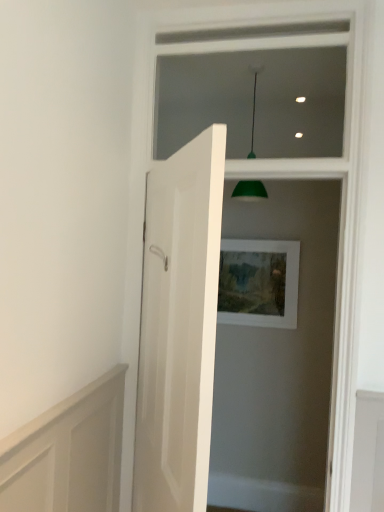
Locate an element on the screen. white wood frame at upper center is located at coordinates (252, 88).

This screenshot has height=512, width=384. Find the location of `white glossy door at center`. white glossy door at center is located at coordinates (179, 326).

What do you see at coordinates (179, 326) in the screenshot? This screenshot has width=384, height=512. I see `white glossy door at center` at bounding box center [179, 326].

At what (x,y) coordinates should I click in order to perform the action: click on green matte lampshade at upper center. Please return your answer as a coordinate pair (x, y). The height and width of the screenshot is (512, 384). Looking at the image, I should click on (250, 190).

Locate an element on the screen. The image size is (384, 512). white wood frame at upper center is located at coordinates (252, 88).

Find the location of `light fixture lying behind the white wood frame at upper center`. light fixture lying behind the white wood frame at upper center is located at coordinates (250, 190).

Looking at this image, is white wood frame at upper center not close to green matte lampshade at upper center?

No, white wood frame at upper center is not far from green matte lampshade at upper center.

Is white wood frame at upper center not within green matte lampshade at upper center?

Yes.

From the image's perspective, is white wood frame at upper center over green matte lampshade at upper center?

Yes, from the image's perspective, white wood frame at upper center is over green matte lampshade at upper center.

Considering the relative positions of white glossy door at center and white wood frame at upper center in the image provided, is white glossy door at center in front of white wood frame at upper center?

That is True.

Is white glossy door at center wider than white wood frame at upper center?

Indeed, white glossy door at center has a greater width compared to white wood frame at upper center.

Which is closer to the camera, (208, 170) or (325, 34)?

Point (208, 170) is positioned closer to the camera compared to point (325, 34).

Is white glossy door at center aimed at white wood frame at upper center?

No, white glossy door at center is not aimed at white wood frame at upper center.

Which point is more distant from viewer, (252, 117) or (258, 117)?

The point (252, 117) is farther.

How much distance is there between green matte lampshade at upper center and white wood frame at upper center?

The distance of green matte lampshade at upper center from white wood frame at upper center is 24.25 inches.

From a real-world perspective, is green matte lampshade at upper center located higher than white wood frame at upper center?

No, from a real-world perspective, green matte lampshade at upper center is not above white wood frame at upper center.

Looking at their sizes, would you say green matte lampshade at upper center is wider or thinner than white wood frame at upper center?

Considering their sizes, green matte lampshade at upper center looks broader than white wood frame at upper center.

From their relative heights in the image, would you say green matte lampshade at upper center is taller or shorter than white glossy door at center?

Clearly, green matte lampshade at upper center is shorter compared to white glossy door at center.

Is point (234, 195) farther from camera compared to point (188, 429)?

Yes, it is behind point (188, 429).

From the image's perspective, is green matte lampshade at upper center located above or below white glossy door at center?

green matte lampshade at upper center is above white glossy door at center.

Which is more to the left, green matte lampshade at upper center or white glossy door at center?

Positioned to the left is white glossy door at center.

From the image's perspective, is white wood frame at upper center above white matte picture frame at center?

Yes, from the image's perspective, white wood frame at upper center is over white matte picture frame at center.

From a real-world perspective, who is located lower, white wood frame at upper center or white matte picture frame at center?

white matte picture frame at center, from a real-world perspective.

Considering their positions, is white wood frame at upper center located in front of or behind white matte picture frame at center?

white wood frame at upper center is in front of white matte picture frame at center.

Who is taller, white wood frame at upper center or white matte picture frame at center?

white wood frame at upper center is taller.

Considering the sizes of objects white matte picture frame at center and white glossy door at center in the image provided, who is wider, white matte picture frame at center or white glossy door at center?

white glossy door at center is wider.

From the picture: From the image's perspective, does white matte picture frame at center appear higher than white glossy door at center?

Yes, from the image's perspective, white matte picture frame at center is above white glossy door at center.

Is white matte picture frame at center at the right side of white glossy door at center?

Yes, white matte picture frame at center is to the right of white glossy door at center.

Is white matte picture frame at center not close to white glossy door at center?

Yes, white matte picture frame at center and white glossy door at center are quite far apart.

Based on the photo, between green matte lampshade at upper center and white matte picture frame at center, which one has less height?

white matte picture frame at center.

Is green matte lampshade at upper center beside white matte picture frame at center?

No.

Consider the image. Does green matte lampshade at upper center have a lesser width compared to white matte picture frame at center?

No, green matte lampshade at upper center is not thinner than white matte picture frame at center.

Is green matte lampshade at upper center positioned with its back to white matte picture frame at center?

green matte lampshade at upper center is not turned away from white matte picture frame at center.

Identify the location of light fixture below the white wood frame at upper center (from a real-world perspective). This screenshot has width=384, height=512. (250, 190).

Find the location of a particular element. This screenshot has width=384, height=512. window frame that is above the white glossy door at center (from a real-world perspective) is located at coordinates (252, 88).

When comparing their distances from white wood frame at upper center, does white glossy door at center or white matte picture frame at center seem further?

white glossy door at center is further to white wood frame at upper center.

When comparing their distances from green matte lampshade at upper center, does white glossy door at center or white wood frame at upper center seem closer?

white wood frame at upper center is positioned closer to the anchor green matte lampshade at upper center.

Estimate the real-world distances between objects in this image. Which object is further from white matte picture frame at center, white glossy door at center or white wood frame at upper center?

white glossy door at center.

Estimate the real-world distances between objects in this image. Which object is further from white wood frame at upper center, green matte lampshade at upper center or white matte picture frame at center?

white matte picture frame at center is further to white wood frame at upper center.

Which object lies nearer to the anchor point white glossy door at center, green matte lampshade at upper center or white wood frame at upper center?

green matte lampshade at upper center is closer to white glossy door at center.

From the image, which object appears to be nearer to white wood frame at upper center, white matte picture frame at center or green matte lampshade at upper center?

green matte lampshade at upper center is positioned closer to the anchor white wood frame at upper center.

Considering their positions, is white matte picture frame at center positioned further to green matte lampshade at upper center than white glossy door at center?

white glossy door at center lies further to green matte lampshade at upper center than the other object.

Looking at the image, which one is located further to white wood frame at upper center, white glossy door at center or green matte lampshade at upper center?

Among the two, white glossy door at center is located further to white wood frame at upper center.

At what (x,y) coordinates should I click in order to perform the action: click on light fixture between white wood frame at upper center and white glossy door at center in the up-down direction. Please return your answer as a coordinate pair (x, y). This screenshot has height=512, width=384. Looking at the image, I should click on (250, 190).

Where is `light fixture between white glossy door at center and white matte picture frame at center from front to back`? This screenshot has height=512, width=384. light fixture between white glossy door at center and white matte picture frame at center from front to back is located at coordinates (250, 190).

Find the location of a particular element. This screenshot has width=384, height=512. window frame between white glossy door at center and white matte picture frame at center from front to back is located at coordinates (252, 88).

Identify the location of light fixture between white wood frame at upper center and white matte picture frame at center in the front-back direction. The image size is (384, 512). (250, 190).